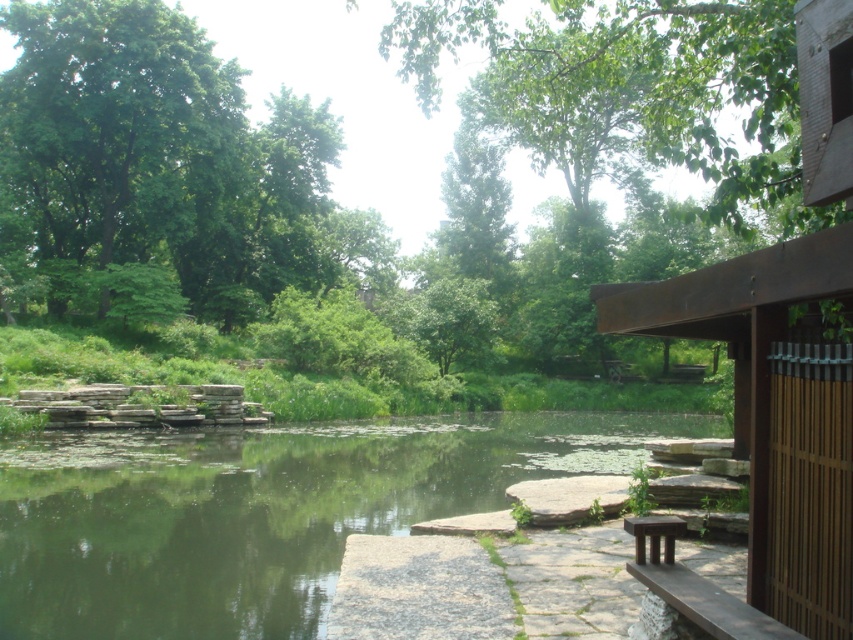
Question: Is green stone river at center thinner than green leafy tree at upper left?

Choices:
 (A) yes
 (B) no

Answer: (B)

Question: Among these points, which one is nearest to the camera?

Choices:
 (A) click(x=183, y=228)
 (B) click(x=7, y=632)

Answer: (B)

Question: Can you confirm if green stone river at center is positioned below green leafy tree at upper left?

Choices:
 (A) no
 (B) yes

Answer: (B)

Question: Where is green stone river at center located in relation to green leafy tree at upper left in the image?

Choices:
 (A) left
 (B) right

Answer: (B)